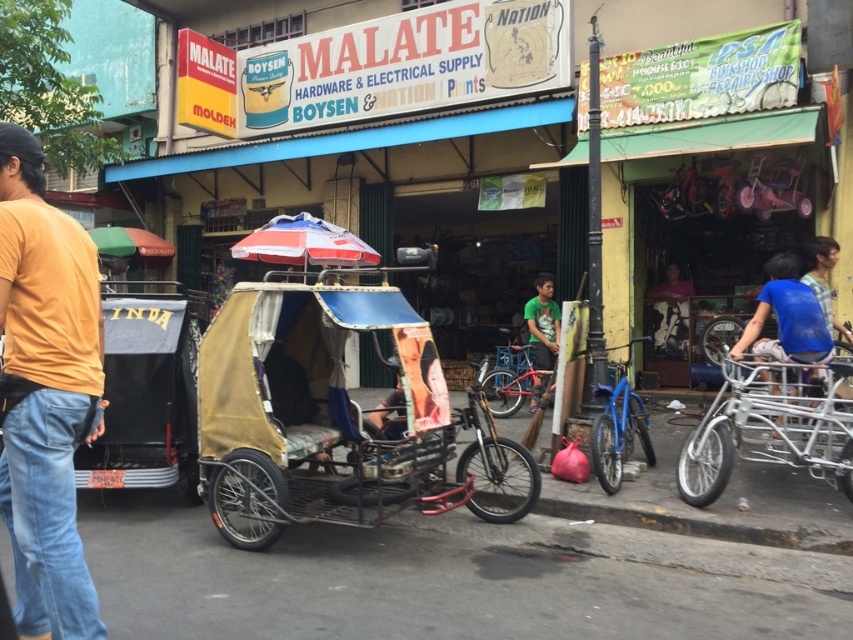
Question: Does yellow cotton shirt at left have a larger size compared to green matte shirt at center?

Choices:
 (A) yes
 (B) no

Answer: (B)

Question: Which is nearer to the silver metallic cart at right?

Choices:
 (A) blue metallic bicycle at center
 (B) blue fabric bicycle at right

Answer: (B)

Question: Can you confirm if silver metallic cart at right is positioned to the right of blue matte bicycle at center-right?

Choices:
 (A) yes
 (B) no

Answer: (A)

Question: Which point is closer to the camera?

Choices:
 (A) (90, 234)
 (B) (755, 323)

Answer: (B)

Question: Does red and white striped umbrella at center appear on the left side of smooth plastic poster at center?

Choices:
 (A) yes
 (B) no

Answer: (A)

Question: Estimate the real-world distances between objects in this image. Which object is farther from the brown fabric tricycle at center?

Choices:
 (A) blue metallic bicycle at center
 (B) blue fabric bicycle at right
 (C) blue matte bicycle at center-right

Answer: (B)